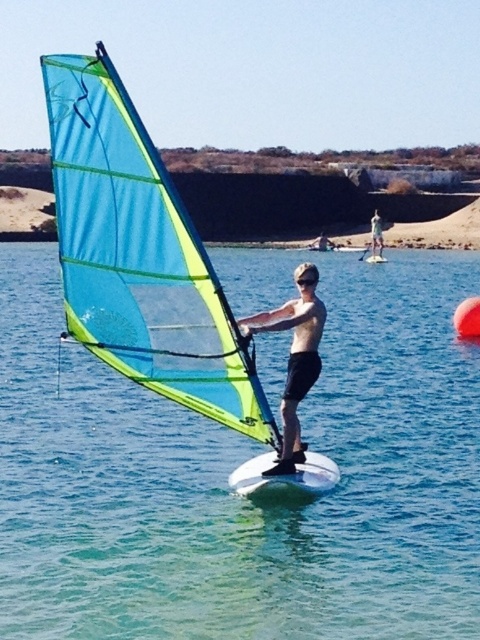
You are a photographer trying to capture the windsurfers in the image. You want to focus on the closer surfboard. Which one should you choose between the white glossy surfboard at center and the white foam surfboard at center?

The white glossy surfboard at center is closer to the viewer, so you should focus on the white glossy surfboard at center.